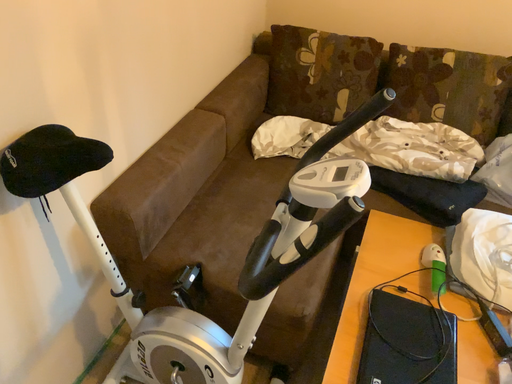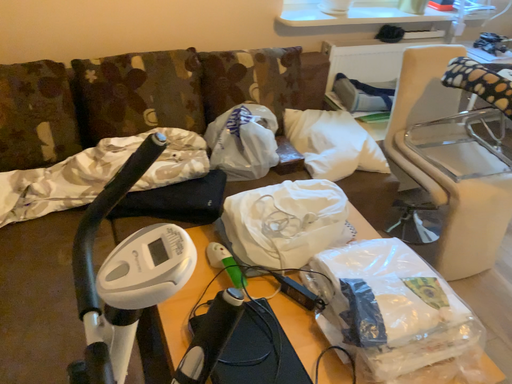
Question: How did the camera likely rotate when shooting the video?

Choices:
 (A) rotated left
 (B) rotated right

Answer: (B)